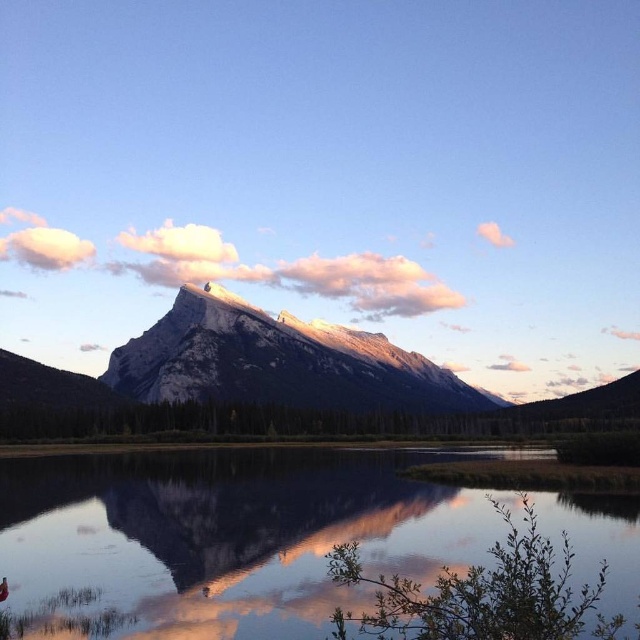
Is point (253, 536) positioned in front of point (490, 225)?

Yes, point (253, 536) is closer to viewer.

Does smooth mountain reflection at center have a larger size compared to pink cotton cloud at upper right?

Indeed, smooth mountain reflection at center has a larger size compared to pink cotton cloud at upper right.

In order to click on smooth mountain reflection at center in this screenshot , I will do `click(259, 515)`.

Does snowy rock mountain at center have a lesser height compared to pink cotton cloud at upper right?

Incorrect, snowy rock mountain at center's height does not fall short of pink cotton cloud at upper right's.

Is snowy rock mountain at center to the left of pink cotton cloud at upper right from the viewer's perspective?

Correct, you'll find snowy rock mountain at center to the left of pink cotton cloud at upper right.

Who is more distant from viewer, [170,371] or [508,240]?

Positioned behind is point [508,240].

At what (x,y) coordinates should I click in order to perform the action: click on snowy rock mountain at center. Please return your answer as a coordinate pair (x, y). This screenshot has width=640, height=640. Looking at the image, I should click on click(280, 362).

Does smooth mountain reflection at center have a greater width compared to white fluffy cloud at upper center?

No, smooth mountain reflection at center is not wider than white fluffy cloud at upper center.

Can you confirm if smooth mountain reflection at center is positioned above white fluffy cloud at upper center?

No.

Is point (337, 476) farther from viewer compared to point (170, 252)?

No, it is not.

Locate an element on the screen. The width and height of the screenshot is (640, 640). smooth mountain reflection at center is located at coordinates (259, 515).